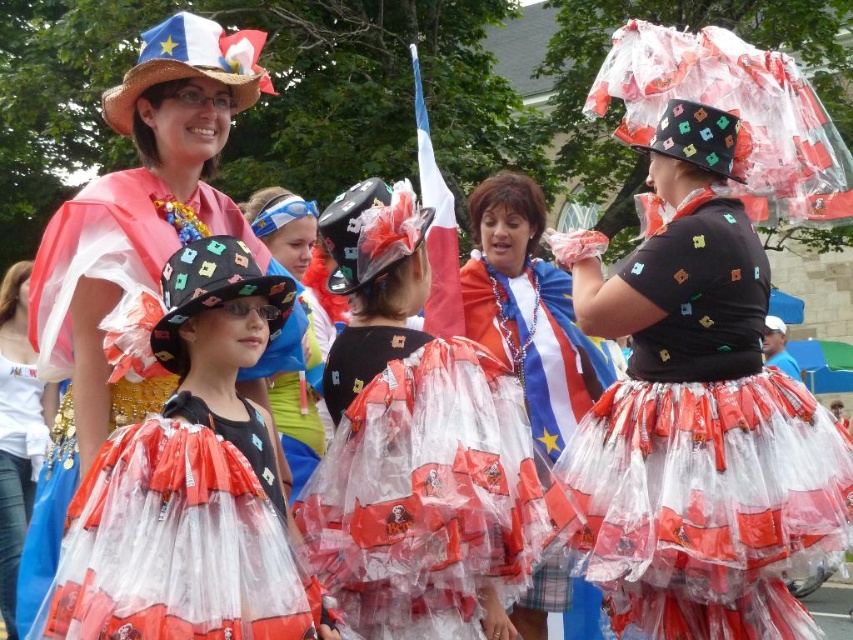
You are a photographer at the event and want to capture a photo that includes both the shiny plastic skirt at center and the matte black hat at upper left. Since you want to highlight both equally, does the size difference between them pose a problem?

The shiny plastic skirt at center is bigger than the matte black hat at upper left, so you may need to adjust your camera angle or position to ensure both are visible and balanced in the frame.

You are a photographer trying to capture a clear photo of the translucent plastic dress at center and the matte black hat at upper left. Since the two objects are at different distances, which one should you focus on first to ensure both are in focus?

The photographer should focus on the matte black hat at upper left first because it is farther away than the translucent plastic dress at center, allowing the dress to be in focus as well if the depth of field is sufficient.

You are a photographer positioned at the center of the scene. You want to capture both the translucent plastic dress at center and the matte black hat at upper left in a single shot. Given that your camera has a maximum focal length of 10 meters, will you be able to include both objects in your frame without moving?

The distance between the translucent plastic dress at center and the matte black hat at upper left is 25.13 meters, which exceeds the camera maximum focal length of 10 meters. Therefore, you cannot capture both objects in a single frame without moving.